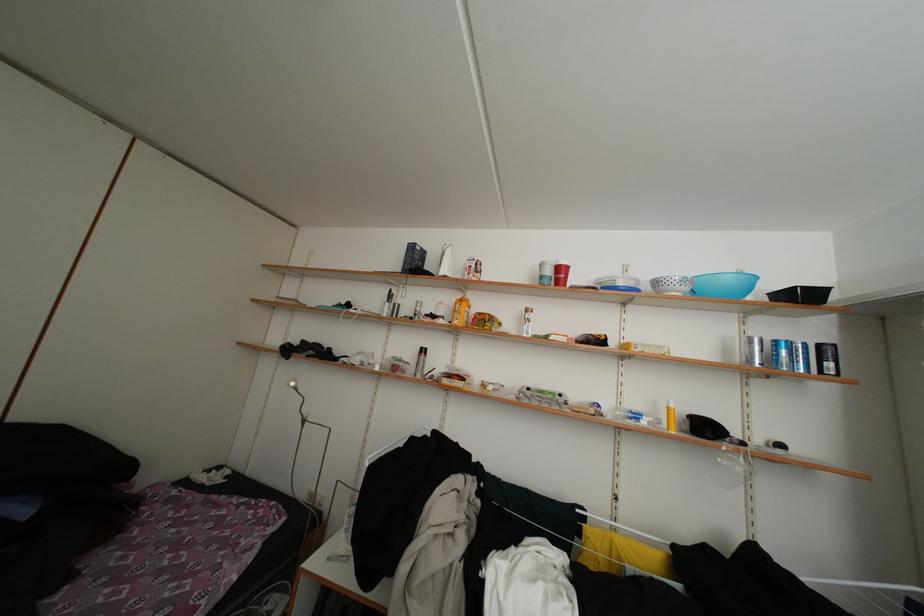
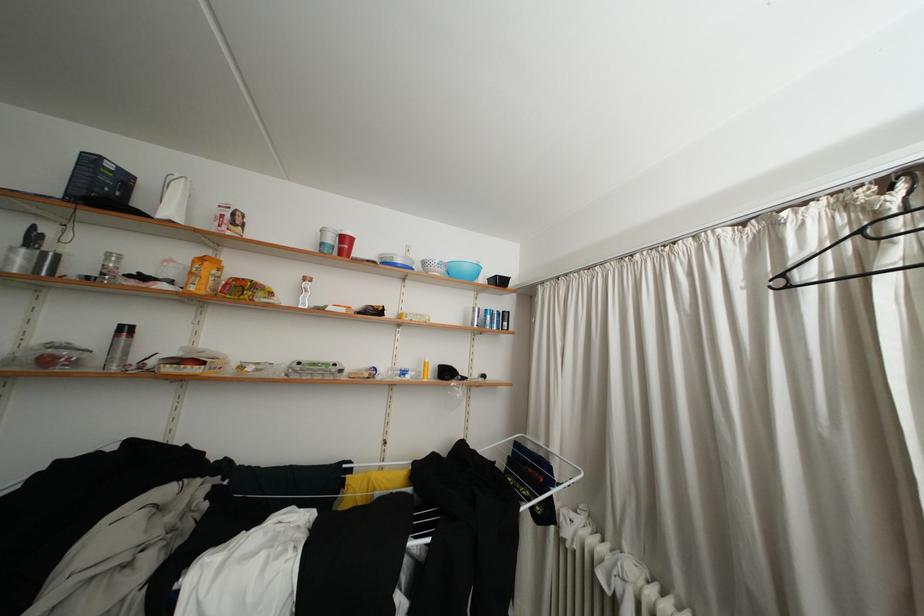
Find the pixel in the second image that matches the point at 556,277 in the first image.

(338, 245)